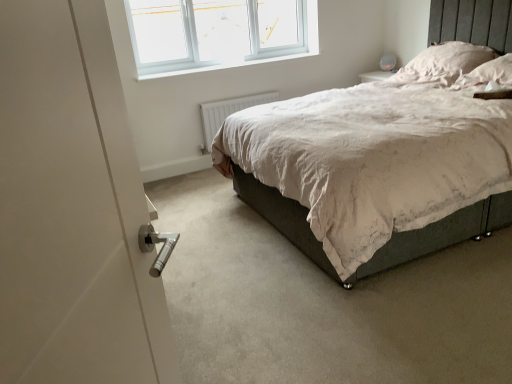
Where is `white smooth window sill at upper center`? white smooth window sill at upper center is located at coordinates coord(227,65).

What do you see at coordinates (227, 65) in the screenshot? I see `white smooth window sill at upper center` at bounding box center [227, 65].

How much space does white soft pillow at upper right, the second pillow when ordered from back to front, occupy vertically?

20.72 centimeters.

At what (x,y) coordinates should I click in order to perform the action: click on white matte radiator at lower center. Please return your answer as a coordinate pair (x, y). The image size is (512, 384). Looking at the image, I should click on (227, 113).

Image resolution: width=512 pixels, height=384 pixels. What do you see at coordinates (443, 63) in the screenshot? I see `white soft pillow at upper right, which is the second pillow from front to back` at bounding box center [443, 63].

Where is `white smooth window sill at upper center`? Image resolution: width=512 pixels, height=384 pixels. white smooth window sill at upper center is located at coordinates pos(227,65).

Between white plastic window at upper center and white matte radiator at lower center, which one is positioned in front?

Positioned in front is white plastic window at upper center.

From the picture: From the image's perspective, would you say white plastic window at upper center is shown under white matte radiator at lower center?

No.

Which object is thinner, white plastic window at upper center or white matte radiator at lower center?

Thinner between the two is white matte radiator at lower center.

Is white soft pillow at upper right, which is the second pillow from front to back, looking in the opposite direction of white soft pillow at upper right, the second pillow when ordered from back to front?

A: No.

Who is bigger, white soft pillow at upper right, the 1th pillow when ordered from back to front, or white soft pillow at upper right, placed as the 1th pillow when sorted from front to back?

white soft pillow at upper right, the 1th pillow when ordered from back to front.

Is white soft pillow at upper right, which is the second pillow from front to back, directly adjacent to white soft pillow at upper right, the second pillow when ordered from back to front?

No, white soft pillow at upper right, which is the second pillow from front to back, is not touching white soft pillow at upper right, the second pillow when ordered from back to front.

Which is in front, white soft pillow at upper right, the 1th pillow when ordered from back to front, or white smooth window sill at upper center?

white soft pillow at upper right, the 1th pillow when ordered from back to front, is more forward.

Is there a large distance between white soft pillow at upper right, the 1th pillow when ordered from back to front, and white smooth window sill at upper center?

Yes, white soft pillow at upper right, the 1th pillow when ordered from back to front, and white smooth window sill at upper center are quite far apart.

This screenshot has width=512, height=384. In order to click on window sill above the white soft pillow at upper right, which is the second pillow from front to back (from the image's perspective) in this screenshot , I will do `click(227, 65)`.

From the image's perspective, between white matte radiator at lower center and white soft pillow at upper right, the second pillow when ordered from back to front, who is located below?

white matte radiator at lower center is shown below in the image.

Is white matte radiator at lower center not within white soft pillow at upper right, the second pillow when ordered from back to front?

white matte radiator at lower center lies outside white soft pillow at upper right, the second pillow when ordered from back to front,'s area.

This screenshot has height=384, width=512. In order to click on the 1st pillow positioned above the white matte radiator at lower center (from a real-world perspective) in this screenshot , I will do `click(487, 74)`.

Would you consider white matte radiator at lower center to be distant from white soft pillow at upper right, the second pillow when ordered from back to front?

white matte radiator at lower center is far away from white soft pillow at upper right, the second pillow when ordered from back to front.

Is white smooth window sill at upper center inside or outside of white plastic window at upper center?

white smooth window sill at upper center cannot be found inside white plastic window at upper center.

Who is taller, white smooth window sill at upper center or white plastic window at upper center?

With more height is white plastic window at upper center.

From the picture: Is white smooth window sill at upper center in front of or behind white plastic window at upper center in the image?

white smooth window sill at upper center is behind white plastic window at upper center.

From the picture: Can you confirm if white smooth window sill at upper center is positioned to the right of white plastic window at upper center?

Indeed, white smooth window sill at upper center is positioned on the right side of white plastic window at upper center.

From the image's perspective, which one is positioned higher, white soft pillow at upper right, which is the second pillow from front to back, or white matte radiator at lower center?

white soft pillow at upper right, which is the second pillow from front to back, is shown above in the image.

Considering the positions of objects white soft pillow at upper right, the 1th pillow when ordered from back to front, and white matte radiator at lower center in the image provided, who is behind, white soft pillow at upper right, the 1th pillow when ordered from back to front, or white matte radiator at lower center?

white matte radiator at lower center is more distant.

Consider the image. Is white soft pillow at upper right, which is the second pillow from front to back, not inside white matte radiator at lower center?

white soft pillow at upper right, which is the second pillow from front to back, lies outside white matte radiator at lower center's area.

From a real-world perspective, is white soft pillow at upper right, the 1th pillow when ordered from back to front, positioned over white matte radiator at lower center based on gravity?

Yes, from a real-world perspective, white soft pillow at upper right, the 1th pillow when ordered from back to front, is above white matte radiator at lower center.

Considering the positions of point (218, 122) and point (219, 61), is point (218, 122) closer or farther from the camera than point (219, 61)?

Point (218, 122) is closer to the camera than point (219, 61).

Who is bigger, white matte radiator at lower center or white plastic window at upper center?

white plastic window at upper center is bigger.

Consider the image. Which object is positioned more to the left, white matte radiator at lower center or white plastic window at upper center?

From the viewer's perspective, white plastic window at upper center appears more on the left side.

Is white plastic window at upper center inside white matte radiator at lower center?

No, white matte radiator at lower center does not contain white plastic window at upper center.

You are a GUI agent. You are given a task and a screenshot of the screen. Output one action in this format:
    pyautogui.click(x=<x>, y=<y>)
    Task: Click on the radiator that is behind the white plastic window at upper center
    
    Given the screenshot: What is the action you would take?
    pyautogui.click(x=227, y=113)

What are the coordinates of `pillow above the white soft pillow at upper right, the second pillow when ordered from back to front (from a real-world perspective)` in the screenshot? It's located at (443, 63).

When comparing their distances from white matte radiator at lower center, does white soft pillow at upper right, the 1th pillow when ordered from back to front, or white plastic window at upper center seem further?

Among the two, white soft pillow at upper right, the 1th pillow when ordered from back to front, is located further to white matte radiator at lower center.

When comparing their distances from white soft pillow at upper right, placed as the 1th pillow when sorted from front to back, does white plastic window at upper center or white smooth window sill at upper center seem further?

white plastic window at upper center.

Which object lies nearer to the anchor point white smooth window sill at upper center, white soft pillow at upper right, the second pillow when ordered from back to front, or white matte radiator at lower center?

Among the two, white matte radiator at lower center is located nearer to white smooth window sill at upper center.

Looking at the image, which one is located closer to white smooth window sill at upper center, white plastic window at upper center or white soft pillow at upper right, placed as the 1th pillow when sorted from front to back?

white plastic window at upper center lies closer to white smooth window sill at upper center than the other object.

From the image, which object appears to be nearer to white soft pillow at upper right, the second pillow when ordered from back to front, white plastic window at upper center or white matte radiator at lower center?

Among the two, white matte radiator at lower center is located nearer to white soft pillow at upper right, the second pillow when ordered from back to front.

Based on their spatial positions, is white smooth window sill at upper center or white plastic window at upper center further from white soft pillow at upper right, which is the second pillow from front to back?

white plastic window at upper center.

From the image, which object appears to be nearer to white plastic window at upper center, white smooth window sill at upper center or white soft pillow at upper right, the second pillow when ordered from back to front?

Based on the image, white smooth window sill at upper center appears to be nearer to white plastic window at upper center.

Based on their spatial positions, is white soft pillow at upper right, placed as the 1th pillow when sorted from front to back, or white plastic window at upper center further from white matte radiator at lower center?

white soft pillow at upper right, placed as the 1th pillow when sorted from front to back, is further to white matte radiator at lower center.

Identify the location of radiator located between white plastic window at upper center and white soft pillow at upper right, the second pillow when ordered from back to front, in the left-right direction. Image resolution: width=512 pixels, height=384 pixels. (227, 113).

The image size is (512, 384). What are the coordinates of `window sill located between white plastic window at upper center and white soft pillow at upper right, which is the second pillow from front to back, in the left-right direction` in the screenshot? It's located at (227, 65).

You are a GUI agent. You are given a task and a screenshot of the screen. Output one action in this format:
    pyautogui.click(x=<x>, y=<y>)
    Task: Click on the radiator situated between white plastic window at upper center and white soft pillow at upper right, which is the second pillow from front to back, from left to right
    
    Given the screenshot: What is the action you would take?
    pyautogui.click(x=227, y=113)

Find the location of `pillow between white smooth window sill at upper center and white soft pillow at upper right, placed as the 1th pillow when sorted from front to back`. pillow between white smooth window sill at upper center and white soft pillow at upper right, placed as the 1th pillow when sorted from front to back is located at coordinates (443, 63).